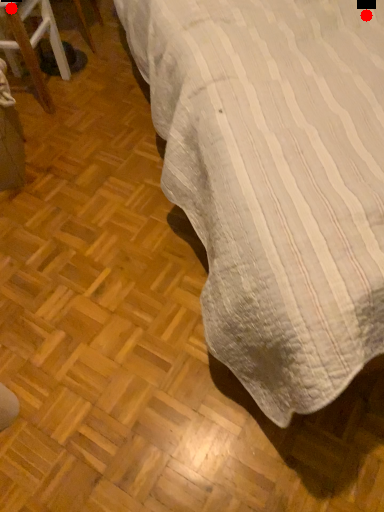
Question: Two points are circled on the image, labeled by A and B beside each circle. Which of the following is the closest to the observer?

Choices:
 (A) A is closer
 (B) B is closer

Answer: (A)